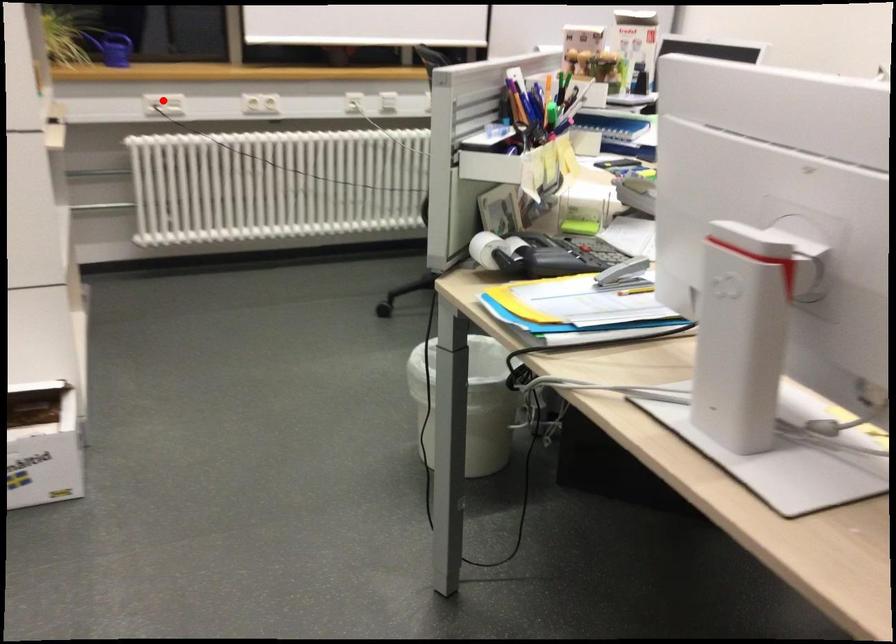
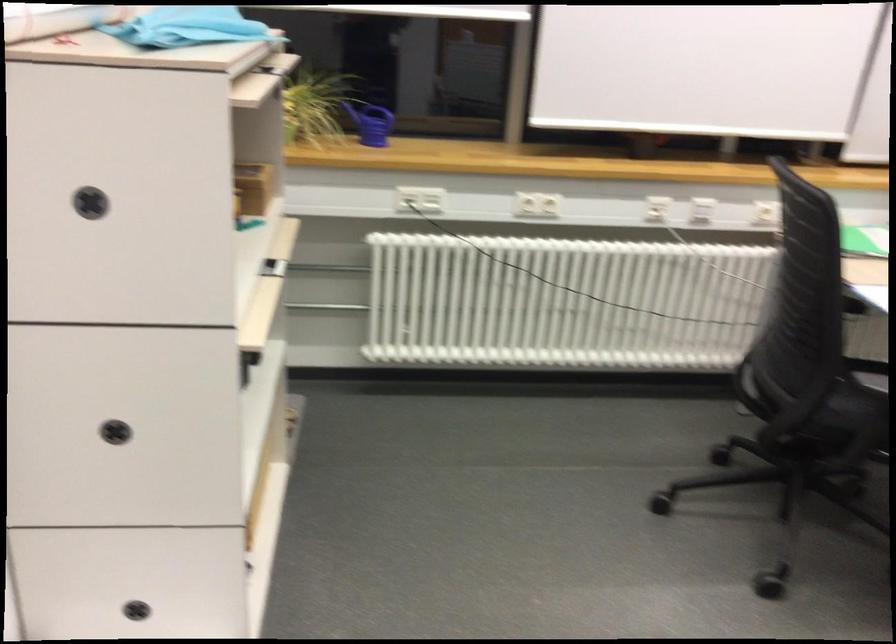
Question: I am providing you with two images of the same scene from different viewpoints. Given a red point in image1, look at the same physical point in image2. Is it:

Choices:
 (A) Closer to the viewpoint
 (B) Farther from the viewpoint

Answer: (A)